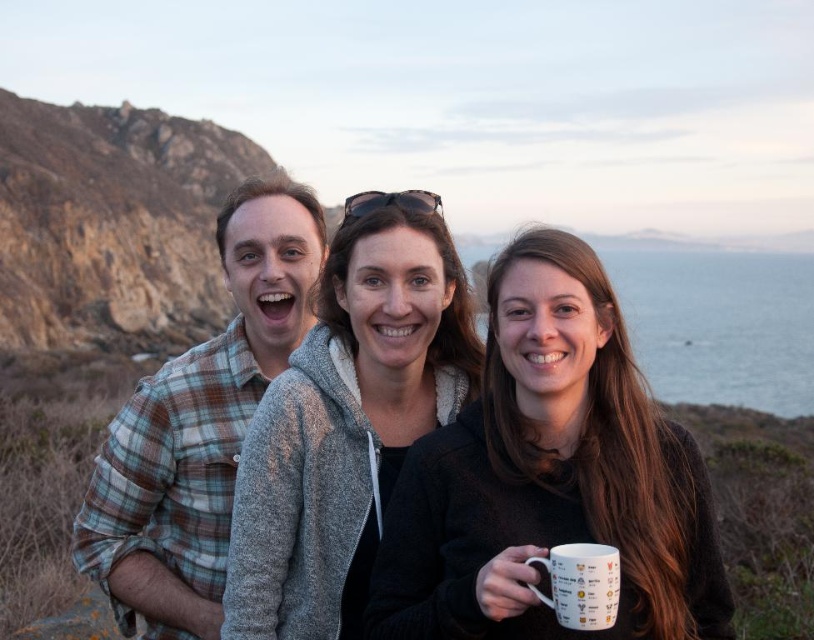
Question: Which object is closer to the camera taking this photo?

Choices:
 (A) plaid flannel shirt at left
 (B) white glossy mug at center

Answer: (B)

Question: Is white glossy mug at center closer to camera compared to plaid flannel shirt at left?

Choices:
 (A) yes
 (B) no

Answer: (A)

Question: Can you confirm if white glossy mug at center is bigger than gray fleece jacket at center?

Choices:
 (A) no
 (B) yes

Answer: (B)

Question: Which object appears closest to the camera in this image?

Choices:
 (A) white ceramic mug at lower right
 (B) plaid flannel shirt at left

Answer: (A)

Question: Does gray fleece jacket at center have a larger size compared to white ceramic mug at lower right?

Choices:
 (A) no
 (B) yes

Answer: (B)

Question: Estimate the real-world distances between objects in this image. Which object is farther from the plaid flannel shirt at left?

Choices:
 (A) white glossy mug at center
 (B) white ceramic mug at lower right

Answer: (B)